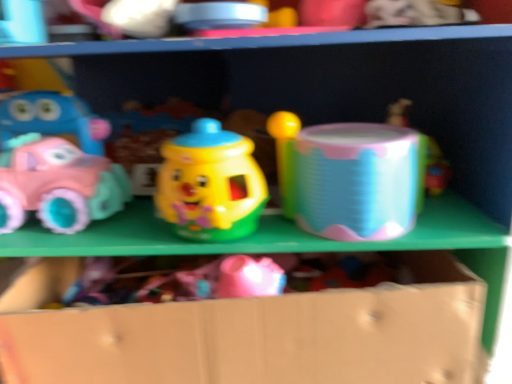
Question: Is matte pink plastic car at left, the 1th toy in the left-to-right sequence, thinner than holographic plastic drum at center, marked as the second toy in a right-to-left arrangement?

Choices:
 (A) no
 (B) yes

Answer: (B)

Question: Is matte pink plastic car at left, which is the fourth toy from right to left, facing towards holographic plastic drum at center, marked as the second toy in a right-to-left arrangement?

Choices:
 (A) yes
 (B) no

Answer: (B)

Question: Considering the relative positions of matte pink plastic car at left, the 1th toy in the left-to-right sequence, and holographic plastic drum at center, which appears as the third toy when viewed from the left, in the image provided, is matte pink plastic car at left, the 1th toy in the left-to-right sequence, in front of holographic plastic drum at center, which appears as the third toy when viewed from the left,?

Choices:
 (A) yes
 (B) no

Answer: (B)

Question: From the image's perspective, is matte pink plastic car at left, the 1th toy in the left-to-right sequence, beneath holographic plastic drum at center, marked as the second toy in a right-to-left arrangement?

Choices:
 (A) yes
 (B) no

Answer: (A)

Question: Is matte pink plastic car at left, the 1th toy in the left-to-right sequence, positioned beyond the bounds of holographic plastic drum at center, marked as the second toy in a right-to-left arrangement?

Choices:
 (A) yes
 (B) no

Answer: (A)

Question: Is shiny plastic toy at center, which is the 3th toy in right-to-left order, to the left or to the right of matte pink plastic car at left, which is the fourth toy from right to left, in the image?

Choices:
 (A) left
 (B) right

Answer: (B)

Question: In the image, is shiny plastic toy at center, which is the second toy from left to right, positioned in front of or behind matte pink plastic car at left, which is the fourth toy from right to left?

Choices:
 (A) front
 (B) behind

Answer: (A)

Question: From a real-world perspective, is shiny plastic toy at center, which is the second toy from left to right, physically located above or below matte pink plastic car at left, the 1th toy in the left-to-right sequence?

Choices:
 (A) above
 (B) below

Answer: (A)

Question: Is point (216, 215) closer or farther from the camera than point (88, 218)?

Choices:
 (A) farther
 (B) closer

Answer: (B)

Question: Visually, is shiny plastic toy at center, which is the second toy from left to right, positioned to the left or to the right of cardboard box at lower center?

Choices:
 (A) left
 (B) right

Answer: (A)

Question: In terms of size, does shiny plastic toy at center, which is the 3th toy in right-to-left order, appear bigger or smaller than cardboard box at lower center?

Choices:
 (A) big
 (B) small

Answer: (B)

Question: Do you think shiny plastic toy at center, which is the 3th toy in right-to-left order, is within cardboard box at lower center, or outside of it?

Choices:
 (A) outside
 (B) inside

Answer: (A)

Question: In terms of width, does shiny plastic toy at center, which is the 3th toy in right-to-left order, look wider or thinner when compared to cardboard box at lower center?

Choices:
 (A) thin
 (B) wide

Answer: (A)

Question: In terms of width, does matte pink plastic car at left, the 1th toy in the left-to-right sequence, look wider or thinner when compared to shiny plastic toy at center, which is the 3th toy in right-to-left order?

Choices:
 (A) thin
 (B) wide

Answer: (A)

Question: Is matte pink plastic car at left, which is the fourth toy from right to left, to the left or to the right of shiny plastic toy at center, which is the 3th toy in right-to-left order, in the image?

Choices:
 (A) left
 (B) right

Answer: (A)